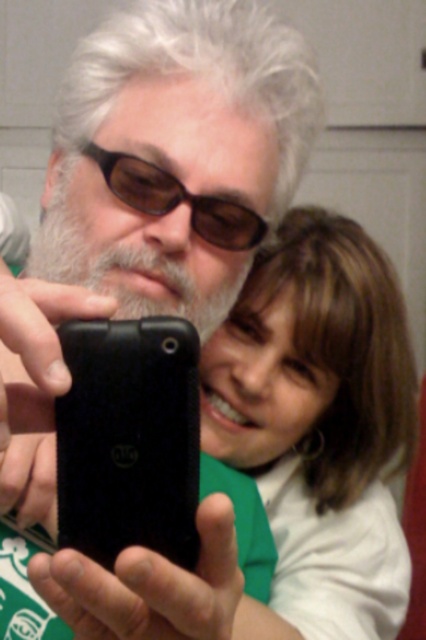
Question: Which point appears closest to the camera in this image?

Choices:
 (A) (149, 285)
 (B) (103, 500)

Answer: (B)

Question: Does black matte smartphone at center have a lesser width compared to white matte beard at center?

Choices:
 (A) no
 (B) yes

Answer: (B)

Question: Can you confirm if black matte smartphone at center is thinner than brown matte sunglasses at center?

Choices:
 (A) yes
 (B) no

Answer: (A)

Question: Which point is farther to the camera?

Choices:
 (A) (51, 278)
 (B) (333, 476)
 (C) (158, 552)

Answer: (B)

Question: Is white matte hair at upper center further to camera compared to white matte beard at center?

Choices:
 (A) no
 (B) yes

Answer: (A)

Question: Which point is closer to the camera?

Choices:
 (A) (402, 544)
 (B) (210, 241)
 (C) (184, 305)
 (D) (81, 140)

Answer: (C)